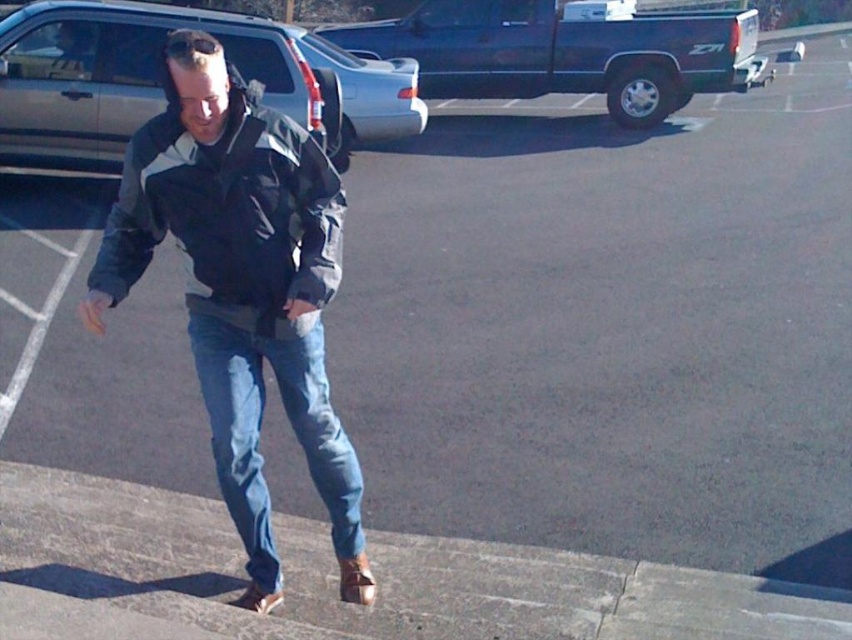
Who is positioned more to the left, dark gray/white jacket at center or metallic blue truck at upper center?

Positioned to the left is metallic blue truck at upper center.

Is point (262, 131) positioned after point (676, 93)?

No.

I want to click on dark gray/white jacket at center, so click(225, 208).

Is concrete at lower left taller than metallic blue truck at upper center?

No, concrete at lower left is not taller than metallic blue truck at upper center.

You are a GUI agent. You are given a task and a screenshot of the screen. Output one action in this format:
    pyautogui.click(x=<x>, y=<y>)
    Task: Click on the concrete at lower left
    This screenshot has width=852, height=640.
    Given the screenshot: What is the action you would take?
    pyautogui.click(x=337, y=579)

Locate an element on the screen. The height and width of the screenshot is (640, 852). concrete at lower left is located at coordinates (337, 579).

Can you confirm if denim jeans at center is positioned to the left of silver metallic suv at upper left?

No, denim jeans at center is not to the left of silver metallic suv at upper left.

Does denim jeans at center have a smaller size compared to silver metallic suv at upper left?

Yes, denim jeans at center is smaller than silver metallic suv at upper left.

At what (x,y) coordinates should I click in order to perform the action: click on denim jeans at center. Please return your answer as a coordinate pair (x, y). This screenshot has height=640, width=852. Looking at the image, I should click on (242, 289).

At what (x,y) coordinates should I click in order to perform the action: click on denim jeans at center. Please return your answer as a coordinate pair (x, y). Image resolution: width=852 pixels, height=640 pixels. Looking at the image, I should click on (242, 289).